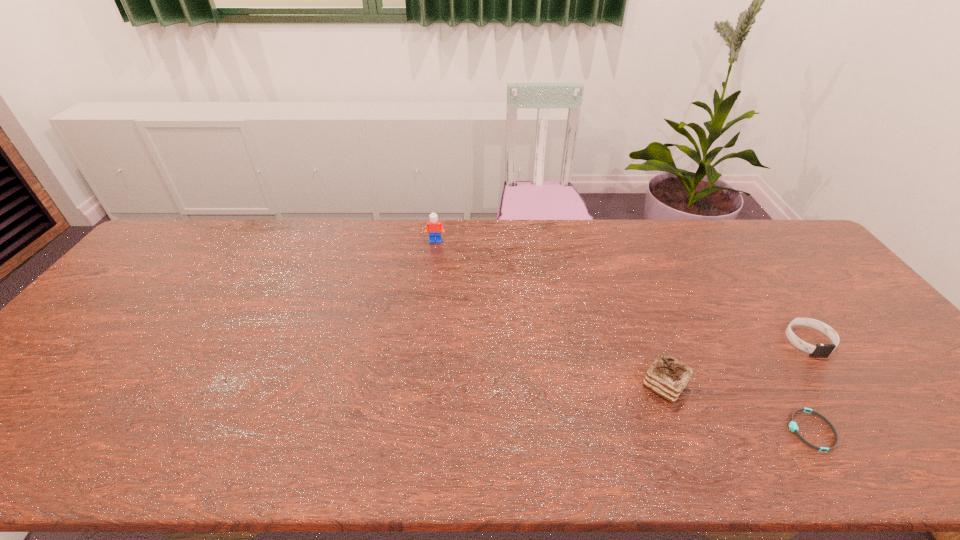
The width and height of the screenshot is (960, 540). I want to click on the leftmost object, so [435, 227].

Where is `Lego`? The image size is (960, 540). Lego is located at coordinates (435, 227).

Identify the location of the third shortest object. (667, 377).

Where is `the second object from left to right`? The height and width of the screenshot is (540, 960). the second object from left to right is located at coordinates tap(667, 377).

Locate an element on the screen. the third tallest object is located at coordinates (820, 350).

Identify the location of the taller wristband. The image size is (960, 540). (820, 350).

Locate an element on the screen. The height and width of the screenshot is (540, 960). the shortest object is located at coordinates (793, 426).

You are a GUI agent. You are given a task and a screenshot of the screen. Output one action in this format:
    pyautogui.click(x=<x>, y=<y>)
    Task: Click on the left wristband
    The height and width of the screenshot is (540, 960).
    Given the screenshot: What is the action you would take?
    pyautogui.click(x=793, y=426)

The width and height of the screenshot is (960, 540). I want to click on vacant space positioned 0.400m on the face of the tallest object, so click(423, 333).

Find the location of `vacant space situated 0.370m on the left of the second tallest object`. vacant space situated 0.370m on the left of the second tallest object is located at coordinates [x=487, y=385].